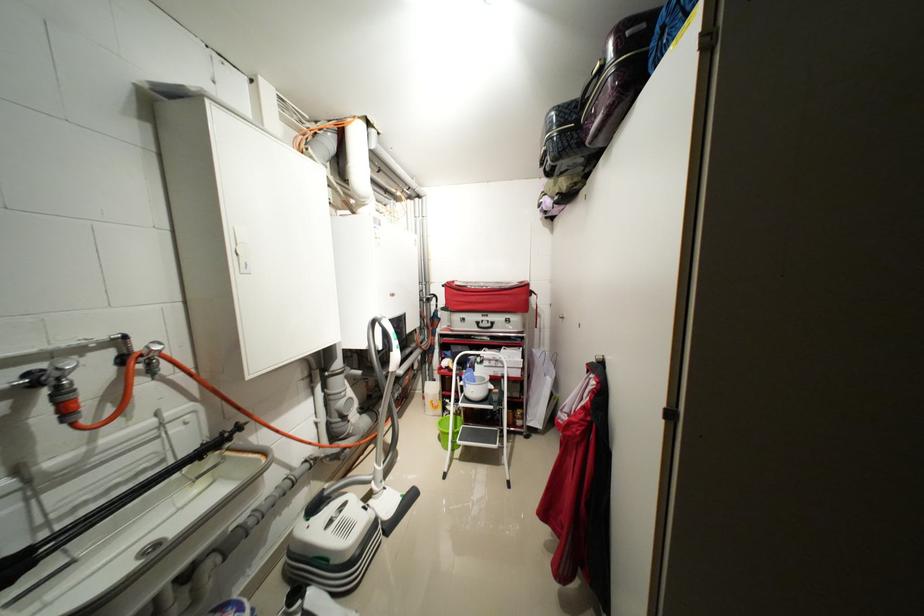
This screenshot has height=616, width=924. Find the location of `white cabinet latch`. white cabinet latch is located at coordinates (242, 251).